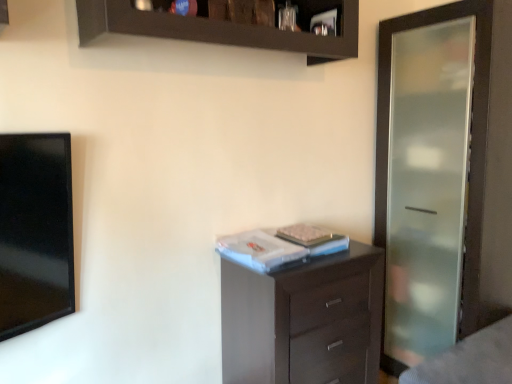
Question: Is frosted glass screen door at right looking in the opposite direction of dark wood chest of drawers at center?

Choices:
 (A) no
 (B) yes

Answer: (A)

Question: Is frosted glass screen door at right smaller than dark wood chest of drawers at center?

Choices:
 (A) yes
 (B) no

Answer: (B)

Question: Does frosted glass screen door at right touch dark wood chest of drawers at center?

Choices:
 (A) no
 (B) yes

Answer: (A)

Question: From the image's perspective, does frosted glass screen door at right appear higher than dark wood chest of drawers at center?

Choices:
 (A) yes
 (B) no

Answer: (A)

Question: Can you confirm if frosted glass screen door at right is positioned to the right of dark wood chest of drawers at center?

Choices:
 (A) yes
 (B) no

Answer: (A)

Question: Is white matte book at center inside the boundaries of frosted glass screen door at right, or outside?

Choices:
 (A) inside
 (B) outside

Answer: (B)

Question: From a real-world perspective, is white matte book at center physically located above or below frosted glass screen door at right?

Choices:
 (A) above
 (B) below

Answer: (B)

Question: Does point (224, 238) appear closer or farther from the camera than point (441, 221)?

Choices:
 (A) farther
 (B) closer

Answer: (B)

Question: Looking at their shapes, would you say white matte book at center is wider or thinner than frosted glass screen door at right?

Choices:
 (A) wide
 (B) thin

Answer: (B)

Question: In terms of size, does frosted glass screen door at right appear bigger or smaller than dark wood chest of drawers at center?

Choices:
 (A) big
 (B) small

Answer: (A)

Question: Is frosted glass screen door at right situated inside dark wood chest of drawers at center or outside?

Choices:
 (A) outside
 (B) inside

Answer: (A)

Question: From the image's perspective, is frosted glass screen door at right above or below dark wood chest of drawers at center?

Choices:
 (A) above
 (B) below

Answer: (A)

Question: Considering the positions of frosted glass screen door at right and dark wood chest of drawers at center in the image, is frosted glass screen door at right taller or shorter than dark wood chest of drawers at center?

Choices:
 (A) tall
 (B) short

Answer: (A)

Question: From their relative heights in the image, would you say white matte book at center is taller or shorter than dark wood chest of drawers at center?

Choices:
 (A) tall
 (B) short

Answer: (B)

Question: In the image, is white matte book at center positioned in front of or behind dark wood chest of drawers at center?

Choices:
 (A) behind
 (B) front

Answer: (A)